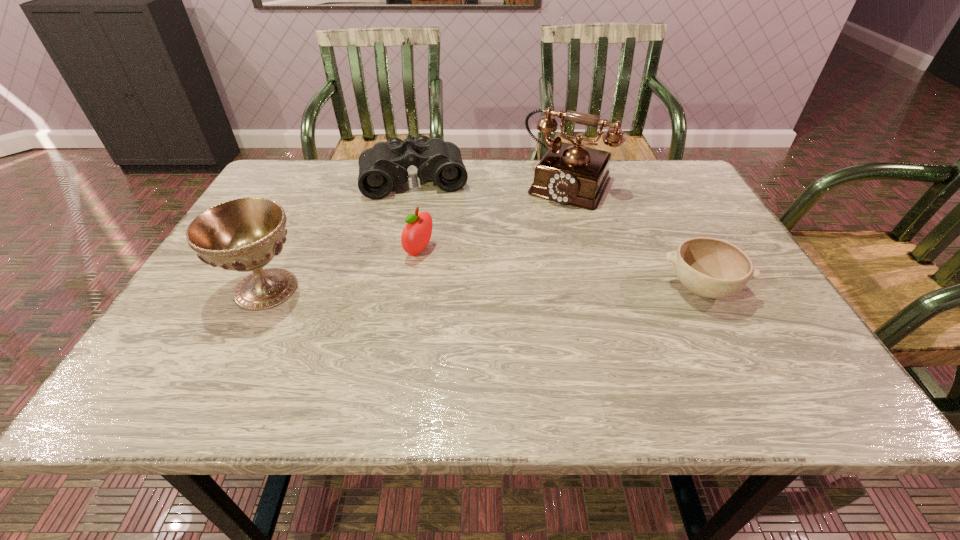
Where is `the second tallest object`? Image resolution: width=960 pixels, height=540 pixels. the second tallest object is located at coordinates (245, 234).

What are the coordinates of `the leftmost object` in the screenshot? It's located at (245, 234).

You are a GUI agent. You are given a task and a screenshot of the screen. Output one action in this format:
    pyautogui.click(x=<x>, y=<y>)
    Task: Click on the bowl
    The height and width of the screenshot is (540, 960).
    Given the screenshot: What is the action you would take?
    pyautogui.click(x=712, y=268)

Identify the location of the rightmost object. This screenshot has width=960, height=540. (712, 268).

What are the coordinates of `binoculars` in the screenshot? It's located at (385, 165).

At what (x,y) coordinates should I click in order to perform the action: click on the tallest object. Please return your answer as a coordinate pair (x, y). This screenshot has width=960, height=540. Looking at the image, I should click on (572, 174).

Where is `the fourth object from left to right`? the fourth object from left to right is located at coordinates (572, 174).

In order to click on apple in this screenshot , I will do `click(416, 234)`.

You are a GUI agent. You are given a task and a screenshot of the screen. Output one action in this format:
    pyautogui.click(x=<x>, y=<y>)
    Task: Click on the vacant area situated on the back of the chalice
    
    Given the screenshot: What is the action you would take?
    pyautogui.click(x=303, y=214)

The image size is (960, 540). Find the location of `free space located on the left of the shortest object`. free space located on the left of the shortest object is located at coordinates (508, 288).